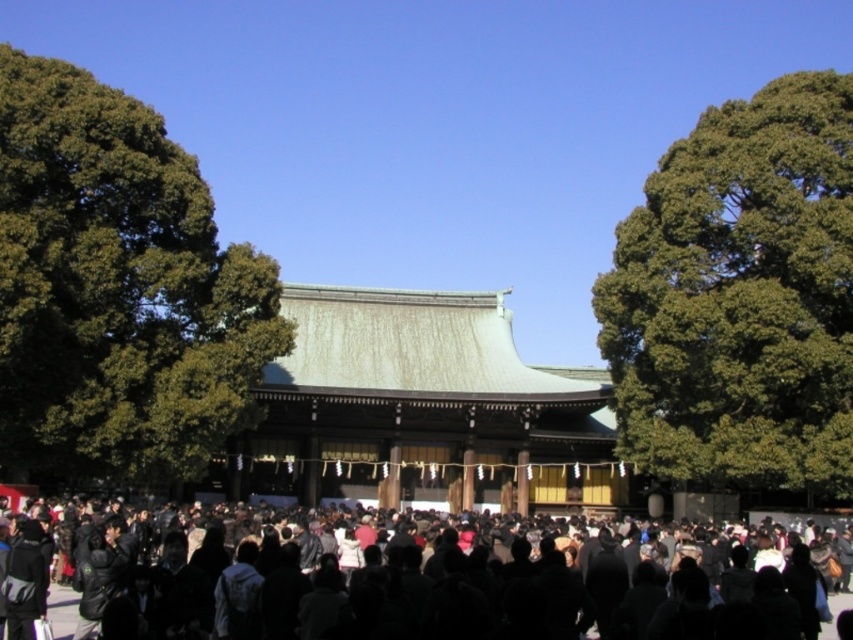
You are a photographer planning to take a group photo of the crowd in front of the traditional Japanese building. You want to ensure both the green leafy tree at left and the green leafy tree at right are visible in the frame. Based on their widths, which tree might require you to adjust your camera angle more to include it fully?

The green leafy tree at left might require adjusting the camera angle more because it might be wider than the green leafy tree at right according to the description.